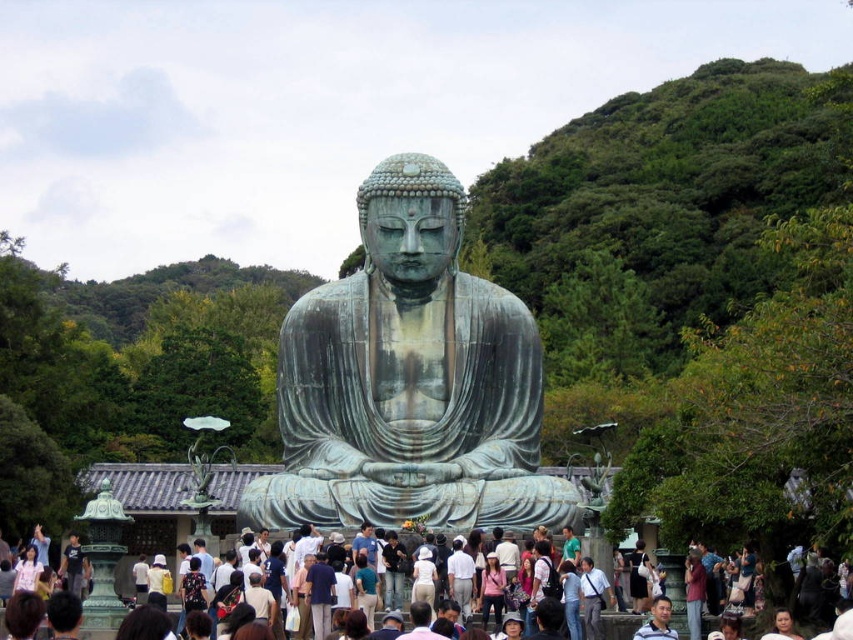
Question: Which point is closer to the camera?

Choices:
 (A) dark blue jeans at center
 (B) white cotton shirt at center
 (C) matte pink shirt at center

Answer: (C)

Question: Does dark brown leather jacket at lower center have a lesser width compared to pink fabric at lower left?

Choices:
 (A) no
 (B) yes

Answer: (B)

Question: Is the position of green patina bronze statue at center less distant than that of light blue shirt at lower center?

Choices:
 (A) no
 (B) yes

Answer: (A)

Question: Which object is the closest to the matte bronze statue at center?

Choices:
 (A) green patina bronze statue at center
 (B) dark blue jeans at center
 (C) light blue shirt at lower center

Answer: (B)

Question: Does matte pink shirt at center have a larger size compared to white cotton shirt at center?

Choices:
 (A) no
 (B) yes

Answer: (A)

Question: Which of the following is the farthest from the observer?

Choices:
 (A) (691, 611)
 (B) (390, 595)

Answer: (A)